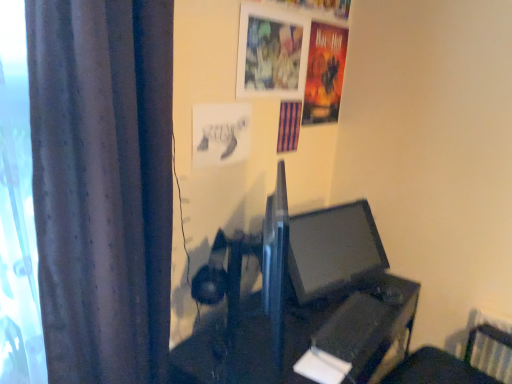
Question: Should I look upward or downward to see matte black monitor at center?

Choices:
 (A) down
 (B) up

Answer: (A)

Question: Considering the relative sizes of purple striped poster at upper center, the 2th poster page viewed from the left, and dark grey fabric curtain at left in the image provided, is purple striped poster at upper center, the 2th poster page viewed from the left, bigger than dark grey fabric curtain at left?

Choices:
 (A) yes
 (B) no

Answer: (B)

Question: Is purple striped poster at upper center, the 2th poster page viewed from the left, completely or partially outside of dark grey fabric curtain at left?

Choices:
 (A) yes
 (B) no

Answer: (A)

Question: Does purple striped poster at upper center, the 2th poster page viewed from the left, have a greater width compared to dark grey fabric curtain at left?

Choices:
 (A) yes
 (B) no

Answer: (B)

Question: Is purple striped poster at upper center, placed as the 2th poster page when sorted from right to left, far from dark grey fabric curtain at left?

Choices:
 (A) no
 (B) yes

Answer: (A)

Question: Is purple striped poster at upper center, placed as the 2th poster page when sorted from right to left, next to dark grey fabric curtain at left?

Choices:
 (A) no
 (B) yes

Answer: (A)

Question: Is purple striped poster at upper center, which ranks as the 2th poster page in back-to-front order, smaller than dark grey fabric curtain at left?

Choices:
 (A) no
 (B) yes

Answer: (B)

Question: Considering the relative positions of matt paper poster at upper right, arranged as the 3th poster page when viewed from the front, and metallic silver picture frame at upper center in the image provided, is matt paper poster at upper right, arranged as the 3th poster page when viewed from the front, to the left of metallic silver picture frame at upper center from the viewer's perspective?

Choices:
 (A) yes
 (B) no

Answer: (B)

Question: Is matt paper poster at upper right, arranged as the 3th poster page when viewed from the front, turned away from metallic silver picture frame at upper center?

Choices:
 (A) yes
 (B) no

Answer: (B)

Question: Does matt paper poster at upper right, which is counted as the first poster page, starting from the right, have a greater width compared to metallic silver picture frame at upper center?

Choices:
 (A) yes
 (B) no

Answer: (B)

Question: Can you confirm if matt paper poster at upper right, which is counted as the third poster page, starting from the left, is bigger than metallic silver picture frame at upper center?

Choices:
 (A) no
 (B) yes

Answer: (B)

Question: Is matt paper poster at upper right, the first poster page in the back-to-front sequence, positioned before metallic silver picture frame at upper center?

Choices:
 (A) no
 (B) yes

Answer: (A)

Question: Is matt paper poster at upper right, the first poster page in the back-to-front sequence, beside metallic silver picture frame at upper center?

Choices:
 (A) yes
 (B) no

Answer: (B)

Question: From the image's perspective, is dark grey fabric curtain at left on purple striped poster at upper center, the 2th poster page viewed from the left?

Choices:
 (A) no
 (B) yes

Answer: (A)